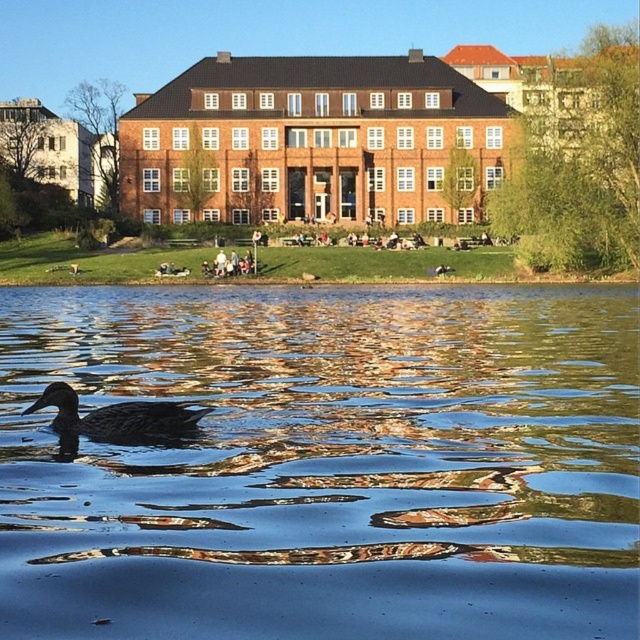
Question: Which of the following is the farthest from the observer?

Choices:
 (A) (108, 428)
 (B) (172, 472)

Answer: (A)

Question: Can you confirm if shiny blue water at center is smaller than brown matte duck at lower left?

Choices:
 (A) yes
 (B) no

Answer: (B)

Question: From the image, what is the correct spatial relationship of shiny blue water at center in relation to brown matte duck at lower left?

Choices:
 (A) below
 (B) above

Answer: (B)

Question: In this image, where is shiny blue water at center located relative to brown matte duck at lower left?

Choices:
 (A) left
 (B) right

Answer: (B)

Question: Which of the following is the closest to the observer?

Choices:
 (A) shiny blue water at center
 (B) brown matte duck at lower left

Answer: (A)